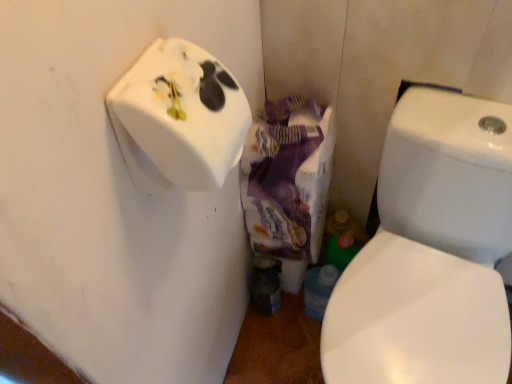
Question: Should I look upward or downward to see white glossy soap dispenser at upper left?

Choices:
 (A) down
 (B) up

Answer: (B)